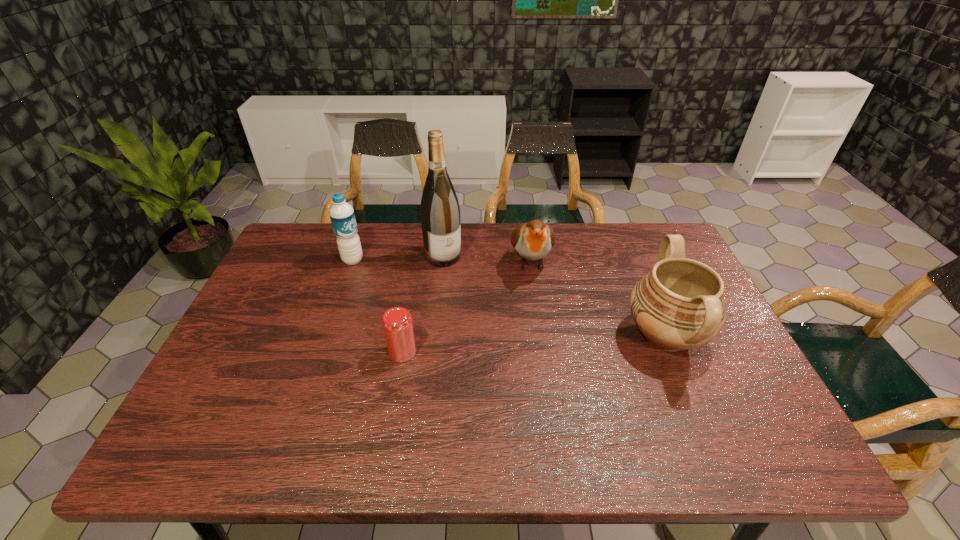
The width and height of the screenshot is (960, 540). What are the coordinates of `free space between the tallest object and the beer can` in the screenshot? It's located at (422, 304).

Locate an element on the screen. vacant area that lies between the wine bottle and the second shortest object is located at coordinates (487, 259).

The width and height of the screenshot is (960, 540). In order to click on vacant space that is in between the rightmost object and the second object from right to left in this screenshot , I will do point(598,299).

You are a GUI agent. You are given a task and a screenshot of the screen. Output one action in this format:
    pyautogui.click(x=<x>, y=<y>)
    Task: Click on the free space between the shortest object and the fourth object from left to right
    This screenshot has width=960, height=540.
    Given the screenshot: What is the action you would take?
    pyautogui.click(x=467, y=307)

Identify which object is located as the nearest to the beer can. Please provide its 2D coordinates. Your answer should be formatted as a tuple, i.e. [(x, y)], where the tuple contains the x and y coordinates of a point satisfying the conditions above.

[(440, 214)]

Select which object appears as the fourth closest to the leftmost object. Please provide its 2D coordinates. Your answer should be formatted as a tuple, i.e. [(x, y)], where the tuple contains the x and y coordinates of a point satisfying the conditions above.

[(679, 305)]

Image resolution: width=960 pixels, height=540 pixels. In order to click on vacant region that satisfies the following two spatial constraints: 1. on the front side of the urn; 2. on the front-facing side of the leftmost object in this screenshot , I will do `click(326, 336)`.

Where is `blank area in the image that satisfies the following two spatial constraints: 1. on the back side of the shortest object; 2. on the right side of the second shortest object`? This screenshot has width=960, height=540. blank area in the image that satisfies the following two spatial constraints: 1. on the back side of the shortest object; 2. on the right side of the second shortest object is located at coordinates (418, 262).

Identify the location of free space that satisfies the following two spatial constraints: 1. on the back side of the water bottle; 2. on the right side of the wine bottle. This screenshot has width=960, height=540. (354, 256).